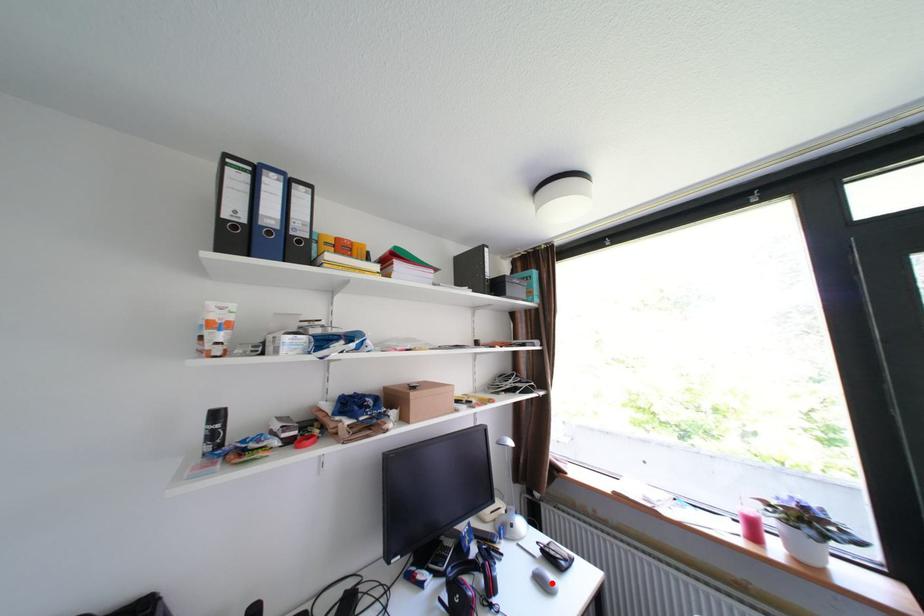
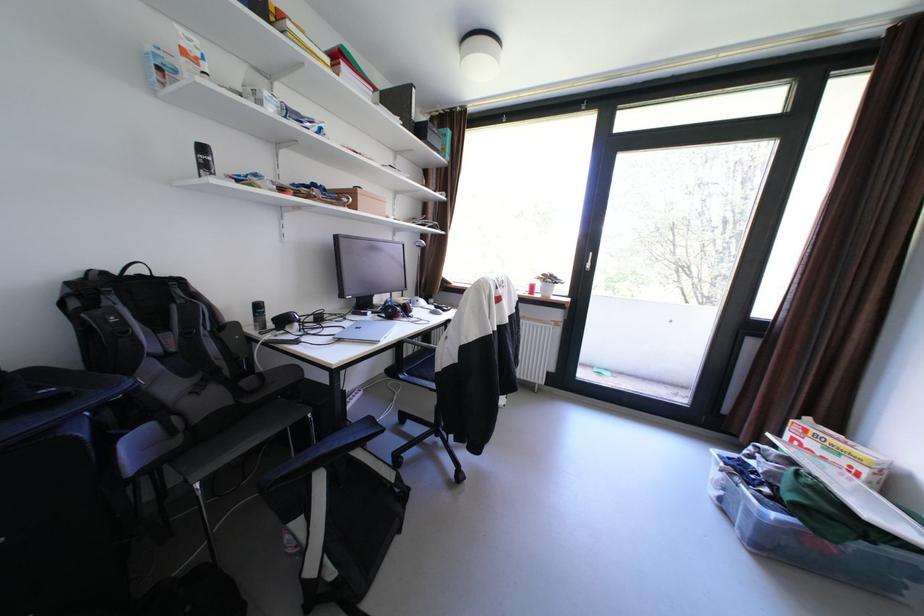
Find the pixel in the second image that matches the highlighted location in the first image.

(444, 314)